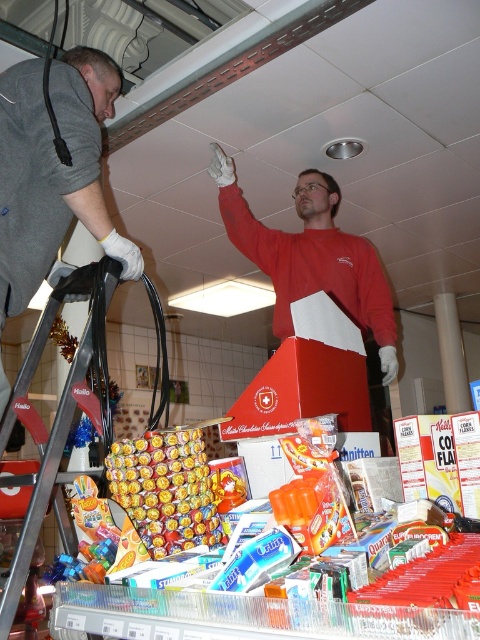
You are a customer in the store and want to reach the matte red sweater at upper center to try it on. The ladder you see is metallic silver ladder at left. Can you safely use the ladder to reach the sweater?

The matte red sweater at upper center is above the metallic silver ladder at left, so the ladder is positioned below the sweater. Since the ladder is at the left, it may not be directly under the sweater, so using it might not be safe or effective to reach the sweater.

You are a delivery person who needs to place a large box between the gray fabric jacket at left and the metallic silver ladder at left. Given that the box is 13 inches wide, will it fit in the space between them?

The space between the gray fabric jacket at left and the metallic silver ladder at left is 13.37 inches. Since the box is 13 inches wide, it will fit with a small amount of space remaining.